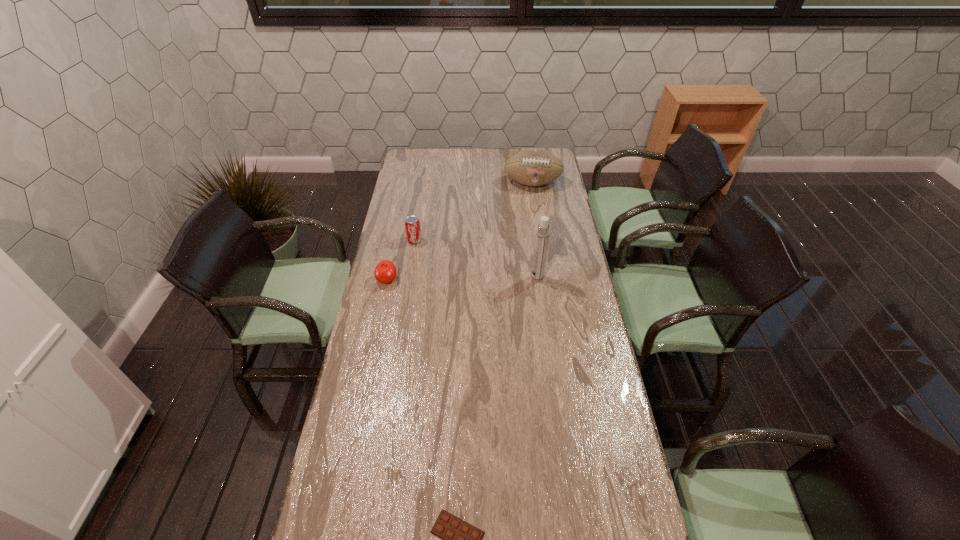
Where is `aerosol can`? Image resolution: width=960 pixels, height=540 pixels. aerosol can is located at coordinates (542, 233).

I want to click on the second tallest object, so pyautogui.click(x=533, y=167).

Where is `football (American)`? football (American) is located at coordinates (533, 167).

Where is `the fourth nearest object`? the fourth nearest object is located at coordinates (412, 224).

Where is `the third tallest object`? the third tallest object is located at coordinates (412, 224).

Identify the location of apple. This screenshot has width=960, height=540. (385, 272).

I want to click on the second shortest object, so click(x=385, y=272).

Where is `vacant position located 0.190m on the left of the aerosol can`? vacant position located 0.190m on the left of the aerosol can is located at coordinates (485, 278).

The image size is (960, 540). Find the location of `free spot located 0.310m on the laces of the farthest object`. free spot located 0.310m on the laces of the farthest object is located at coordinates (540, 233).

This screenshot has height=540, width=960. What are the coordinates of `free region located 0.100m on the left of the fourth nearest object` in the screenshot? It's located at (384, 240).